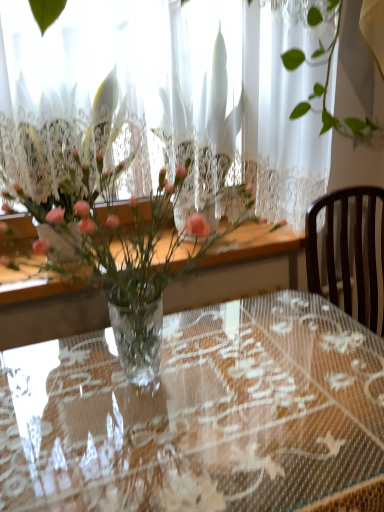
Where is `blank area beneath translucent glass vase at center (from a real-world perspective)`? blank area beneath translucent glass vase at center (from a real-world perspective) is located at coordinates (138, 386).